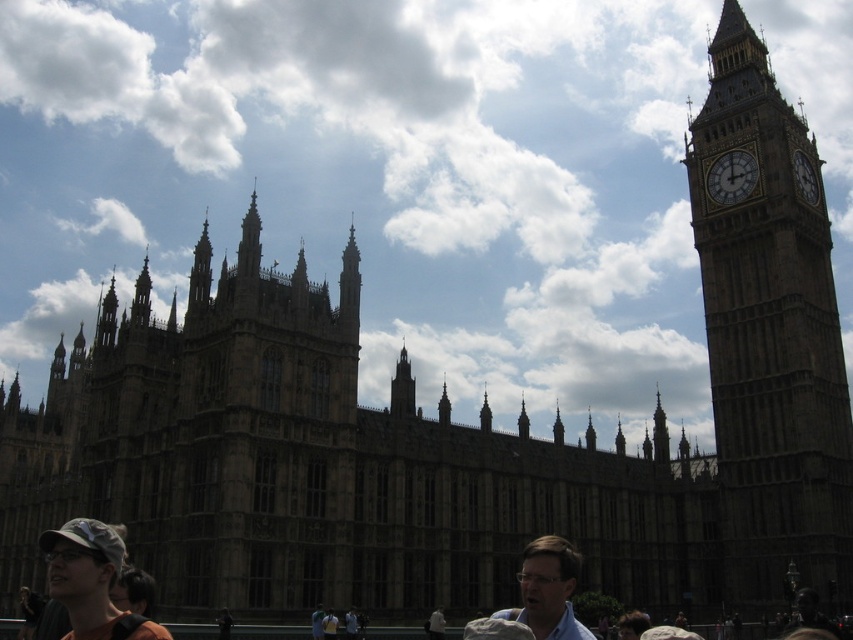
Question: Is brown stone building at center wider than brown leather jacket at lower center?

Choices:
 (A) no
 (B) yes

Answer: (B)

Question: Considering the relative positions of camouflage fabric cap at lower left and blue fabric shirt at lower center in the image provided, where is camouflage fabric cap at lower left located with respect to blue fabric shirt at lower center?

Choices:
 (A) right
 (B) left

Answer: (B)

Question: Which point is farther to the camera?

Choices:
 (A) (96, 540)
 (B) (525, 625)
 (C) (527, 557)
 (D) (357, 600)

Answer: (D)

Question: Which of the following is the farthest from the observer?

Choices:
 (A) (552, 612)
 (B) (688, 468)
 (C) (109, 554)
 (D) (751, 184)

Answer: (D)

Question: Is brown stone building at center below white stone clock at upper right?

Choices:
 (A) yes
 (B) no

Answer: (A)

Question: Which object is farther from the camera taking this photo?

Choices:
 (A) camouflage fabric cap at lower left
 (B) brown stone building at center
 (C) blue fabric shirt at lower center

Answer: (B)